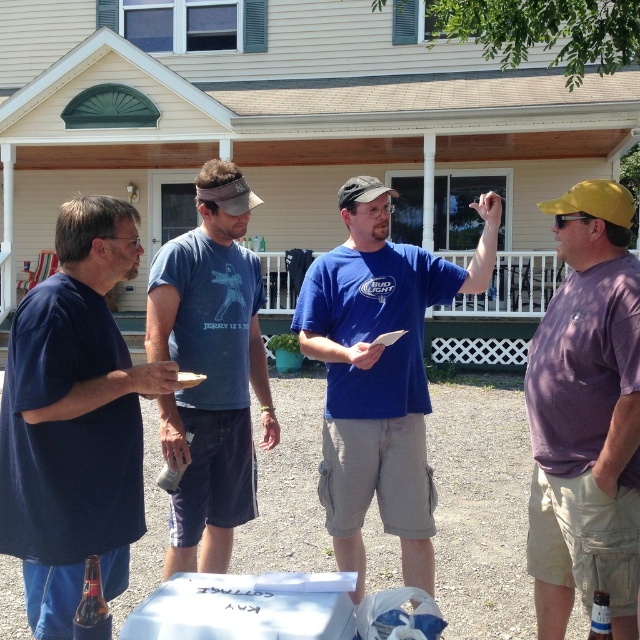
You are a delivery person who needs to leave a package at the location shown. You see the blue cotton shirt at center and the matte plastic cup at center. How far apart are these two items?

The distance between the blue cotton shirt at center and the matte plastic cup at center is 4.35 feet.